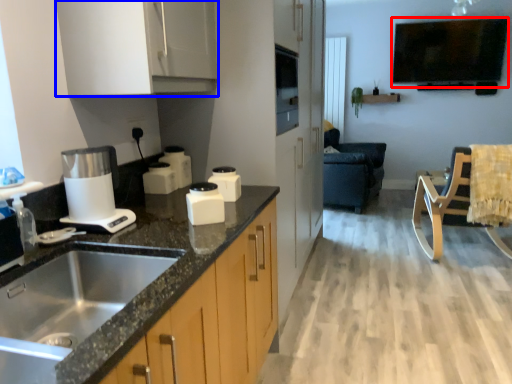
Question: Which point is closer to the camera, window screen (highlighted by a red box) or cabinetry (highlighted by a blue box)?

Choices:
 (A) window screen
 (B) cabinetry

Answer: (B)